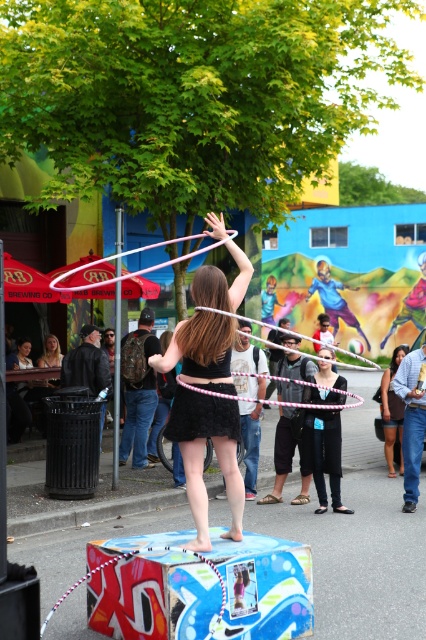
Question: Can you confirm if matte pink hula hoop at center is positioned below black matte dress at center?

Choices:
 (A) no
 (B) yes

Answer: (A)

Question: Does matte black backpack at center have a greater width compared to black matte dress at center?

Choices:
 (A) yes
 (B) no

Answer: (A)

Question: Which object is farther from the camera taking this photo?

Choices:
 (A) matte black dress at center
 (B) matte pink hula hoop at center
 (C) matte black backpack at center

Answer: (A)

Question: Can you confirm if matte pink hula hoop at center is positioned above matte black backpack at center?

Choices:
 (A) no
 (B) yes

Answer: (B)

Question: Among these points, which one is nearest to the camera?

Choices:
 (A) [190, 484]
 (B) [39, 365]
 (C) [160, 346]

Answer: (A)

Question: Estimate the real-world distances between objects in this image. Which object is closer to the matte black dress at center?

Choices:
 (A) matte pink hula hoop at center
 (B) black matte dress at center
 (C) matte black backpack at center
 (D) blonde hair at center

Answer: (B)